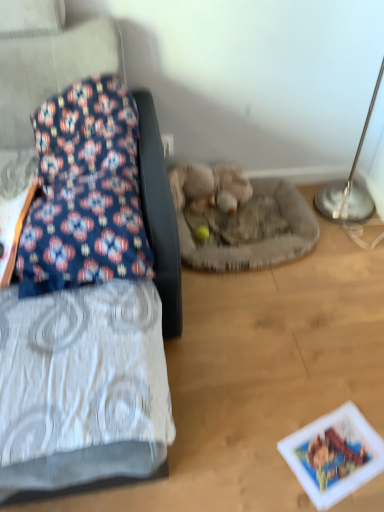
This screenshot has height=512, width=384. Identify the location of vacant area situated to the left side of printed paper postcard at lower right. (265, 448).